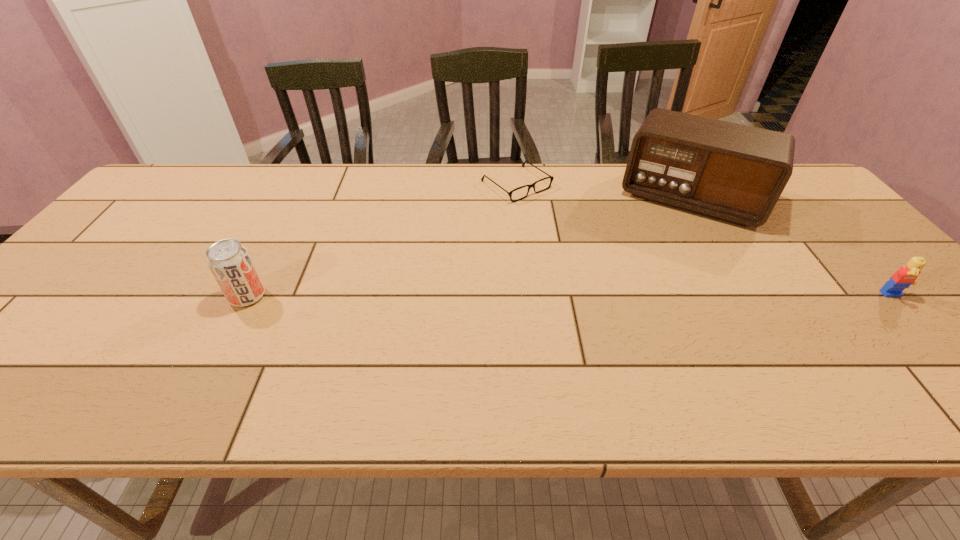
This screenshot has height=540, width=960. I want to click on vacant area that lies between the third object from right to left and the second shortest object, so click(x=705, y=240).

Locate an element on the screen. The height and width of the screenshot is (540, 960). vacant area that lies between the tallest object and the leftmost object is located at coordinates (469, 247).

Locate an element on the screen. free spot between the third object from left to right and the leftmost object is located at coordinates (469, 247).

Locate an element on the screen. The image size is (960, 540). vacant area that lies between the soda can and the radio receiver is located at coordinates (469, 247).

Identify the location of object that is the third closest to the rightmost object. The height and width of the screenshot is (540, 960). (229, 261).

Identify which object is located as the second nearest to the second shortest object. Please provide its 2D coordinates. Your answer should be formatted as a tuple, i.e. [(x, y)], where the tuple contains the x and y coordinates of a point satisfying the conditions above.

[(551, 177)]

Find the location of a particular element. free space that satisfies the following two spatial constraints: 1. on the front side of the shortest object; 2. on the right side of the tallest object is located at coordinates (518, 199).

Image resolution: width=960 pixels, height=540 pixels. I want to click on vacant space that satisfies the following two spatial constraints: 1. on the front side of the spectacles; 2. on the right side of the second object from right to left, so click(518, 199).